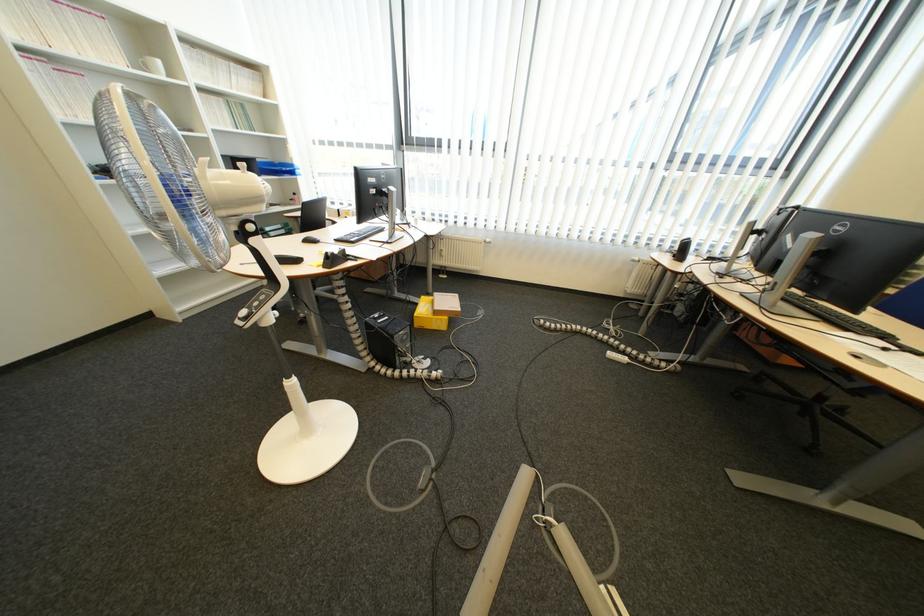
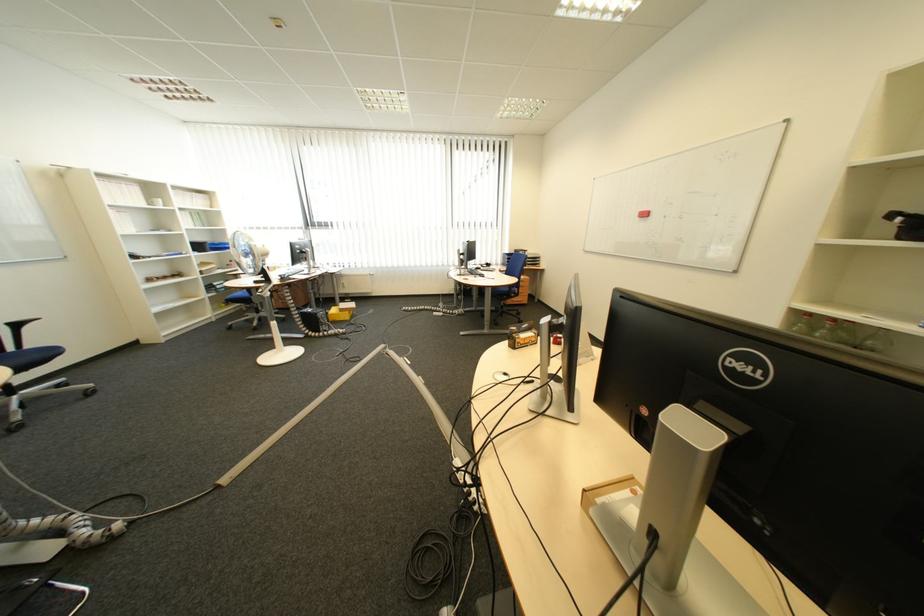
Where in the second image is the point corresponding to pixel 418 339 from the first image?

(335, 317)